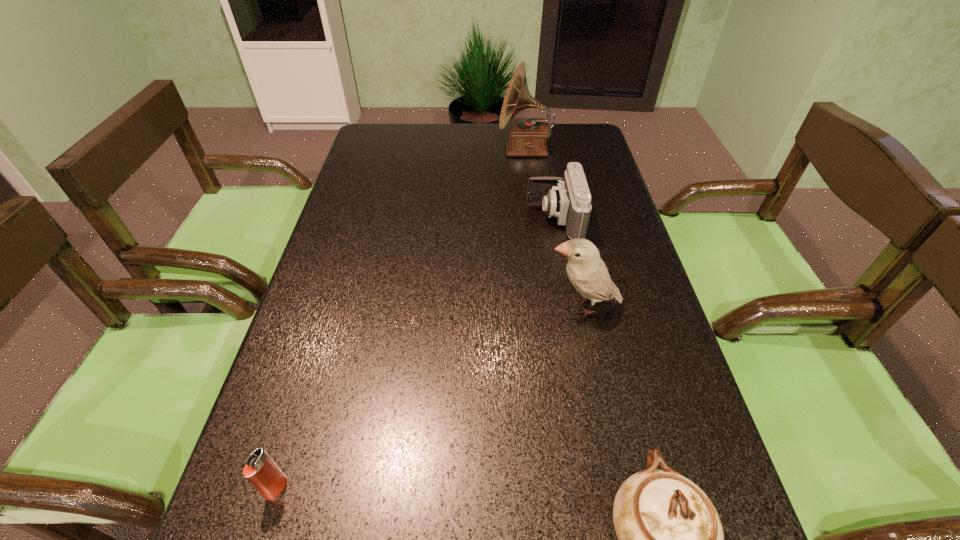
You are a GUI agent. You are given a task and a screenshot of the screen. Output one action in this format:
    pyautogui.click(x=<x>, y=<y>)
    Task: Click on the object that is the nearest to the igniter
    
    Given the screenshot: What is the action you would take?
    pyautogui.click(x=670, y=538)

Image resolution: width=960 pixels, height=540 pixels. Identify the location of free region that satisfies the following two spatial constraints: 1. at the face of the second tallest object; 2. on the front side of the leftmost object. (621, 488).

You are a GUI agent. You are given a task and a screenshot of the screen. Output one action in this format:
    pyautogui.click(x=<x>, y=<y>)
    Task: Click on the vacant area in the image that satisfies the following two spatial constraints: 1. at the face of the third farthest object; 2. on the front side of the leftmost object
    This screenshot has width=960, height=540.
    Given the screenshot: What is the action you would take?
    pyautogui.click(x=621, y=488)